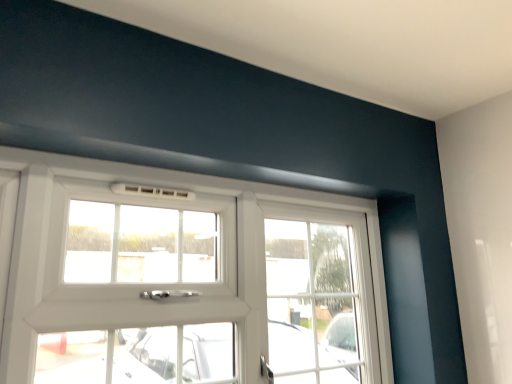
I want to click on white plastic window at center, so click(168, 284).

Describe the element at coordinates (168, 284) in the screenshot. Image resolution: width=512 pixels, height=384 pixels. I see `white plastic window at center` at that location.

Where is `white plastic window at center`? The width and height of the screenshot is (512, 384). white plastic window at center is located at coordinates (168, 284).